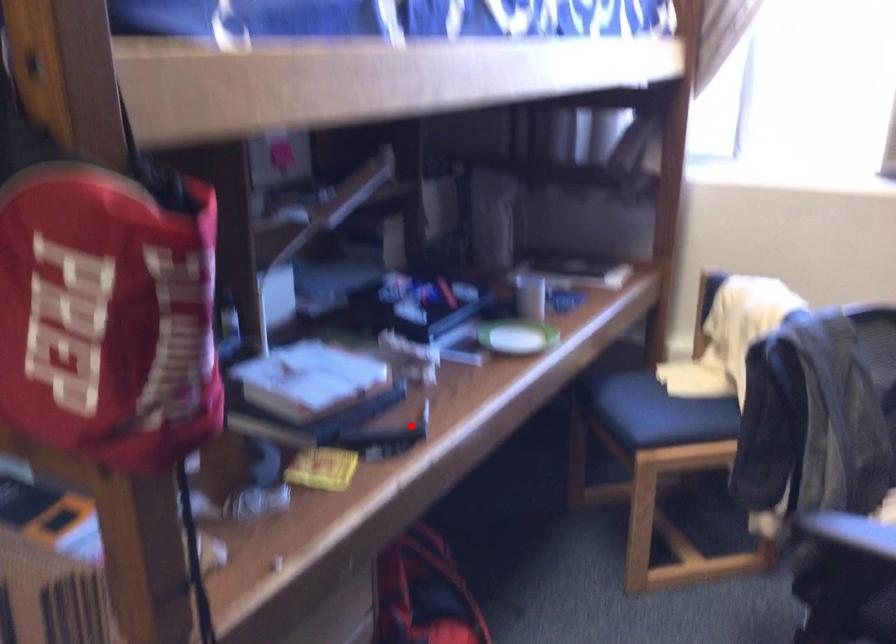
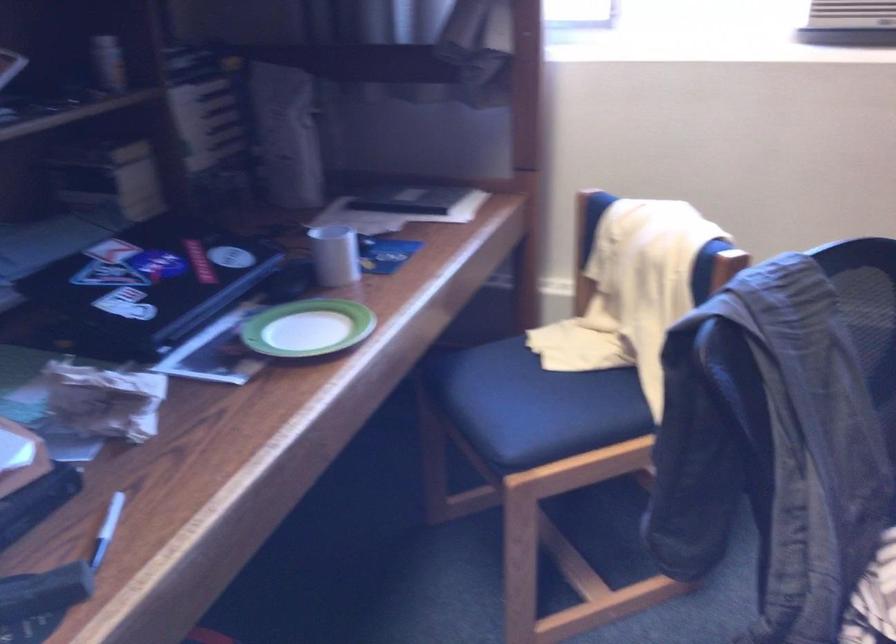
Question: I am providing you with two images of the same scene from different viewpoints. In image1, a red point is highlighted. Considering the same 3D point in image2, which of the following is correct?

Choices:
 (A) It is closer
 (B) It is farther

Answer: (A)